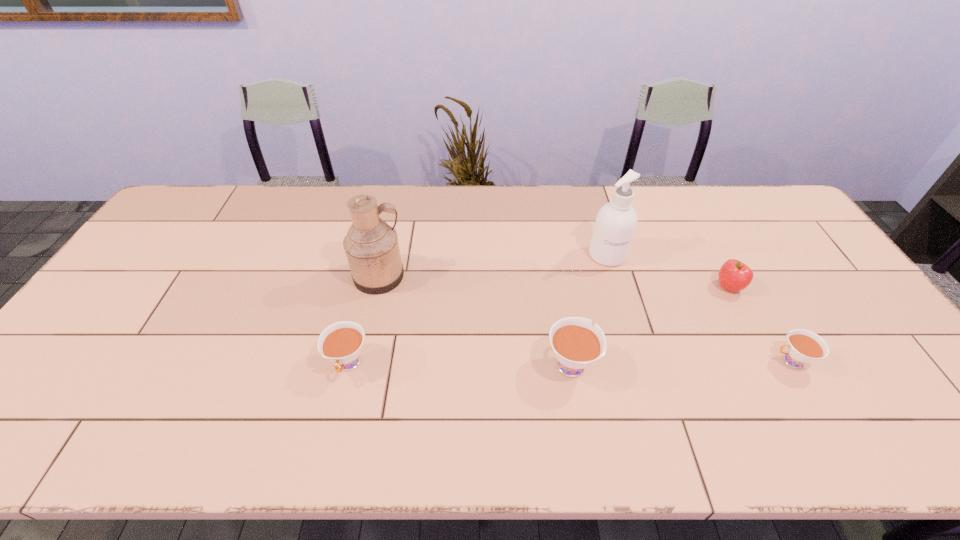
Identify the location of vacant place for an extra teacup on the left. The image size is (960, 540). (126, 366).